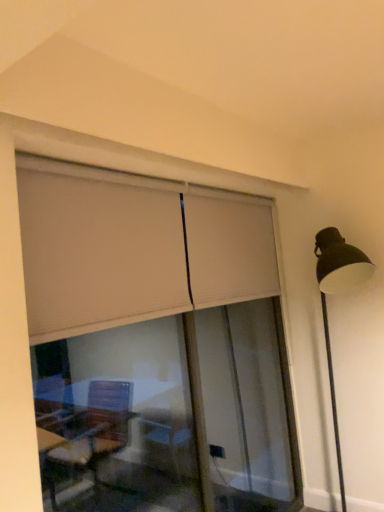
Question: Is white matte window frame at upper center wider or thinner than matte black lamp post at right?

Choices:
 (A) thin
 (B) wide

Answer: (A)

Question: Looking at the image, does white matte window frame at upper center seem bigger or smaller compared to matte black lamp post at right?

Choices:
 (A) big
 (B) small

Answer: (B)

Question: Which object is positioned closest to the matte black lamp post at right?

Choices:
 (A) beige fabric curtain at upper center
 (B) white matte window frame at upper center

Answer: (B)

Question: Which object is positioned closest to the matte black lamp post at right?

Choices:
 (A) beige fabric curtain at upper center
 (B) white matte window frame at upper center

Answer: (B)